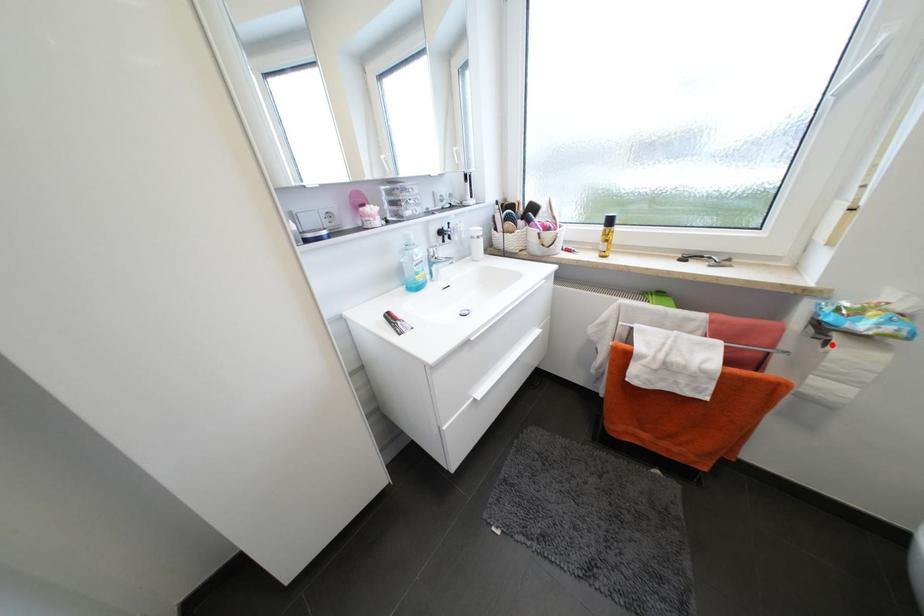
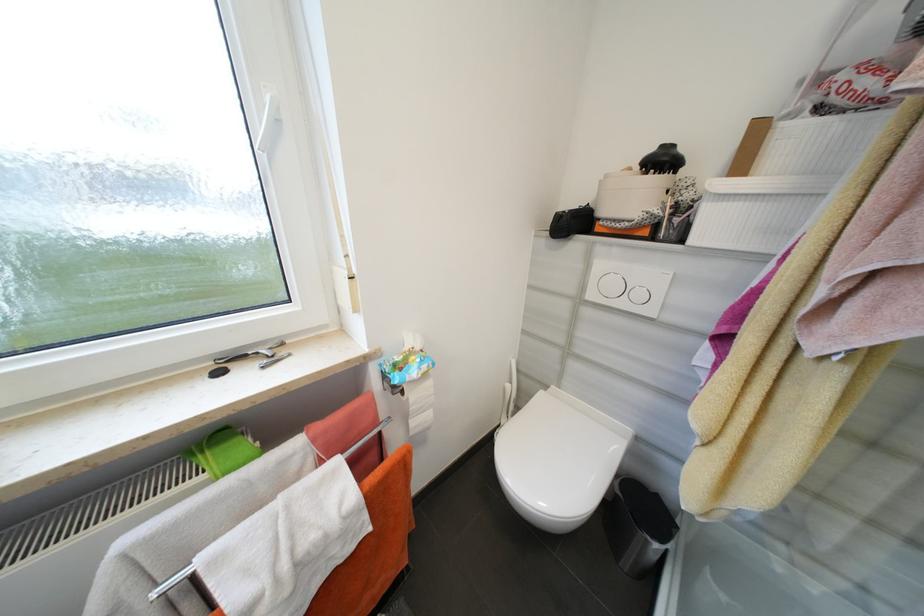
Locate, in the second image, the point that corresponds to the highlighted location in the first image.

(407, 392)